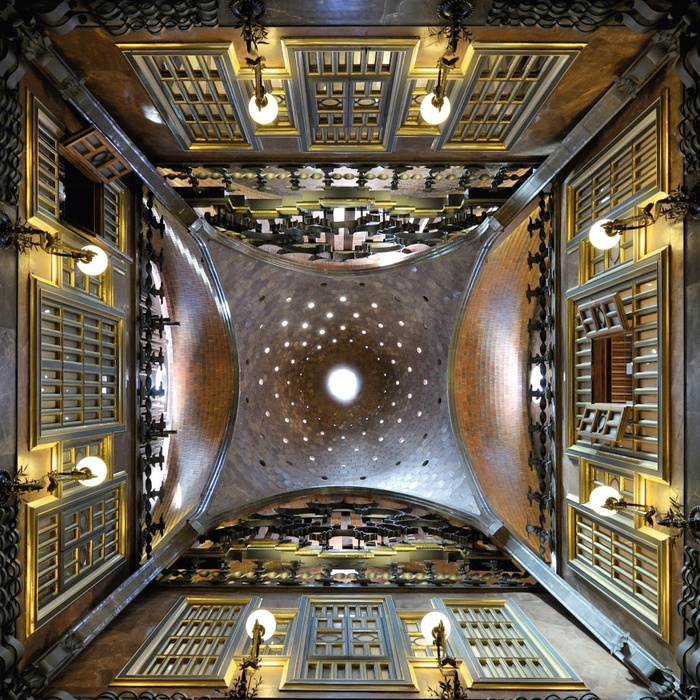
This screenshot has height=700, width=700. I want to click on corner, so click(682, 685), click(17, 680), click(14, 26), click(677, 12).